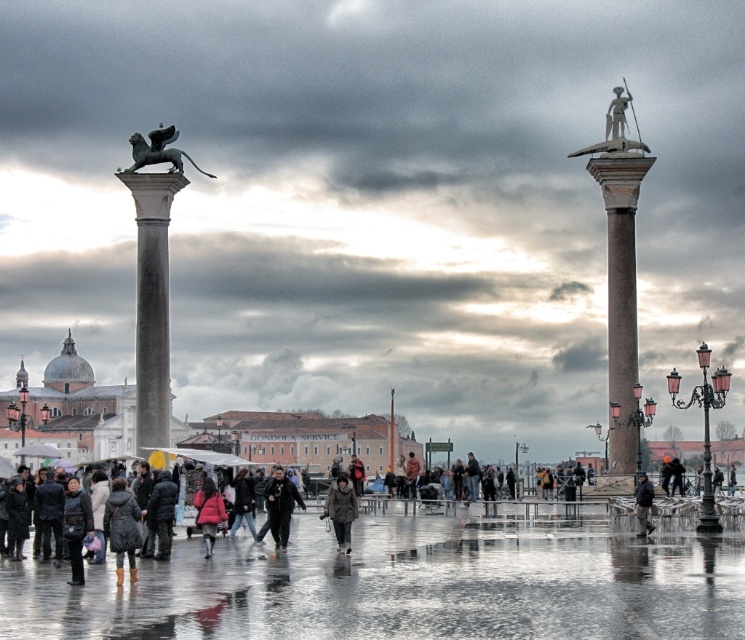
Is dark gray leather jacket at lower left closer to camera compared to dark gray jacket at lower right?

That is True.

Where is `dark gray leather jacket at lower left`? dark gray leather jacket at lower left is located at coordinates (76, 525).

In the scene shown: Measure the distance between point (82, 525) and camera.

Point (82, 525) and camera are 71.53 meters apart.

I want to click on dark gray leather jacket at lower left, so click(x=76, y=525).

Is dark gray leather jacket at lower left taller than matte pink coat at center?

Indeed, dark gray leather jacket at lower left has a greater height compared to matte pink coat at center.

Which is in front, point (74, 525) or point (203, 540)?

Point (74, 525) is in front.

Identify the location of dark gray leather jacket at lower left. (76, 525).

This screenshot has width=745, height=640. What are the coordinates of `dark gray leather jacket at lower left` in the screenshot? It's located at (76, 525).

Looking at this image, who is shorter, dark gray jacket at center or dark gray jacket at lower right?

Standing shorter between the two is dark gray jacket at lower right.

Which is above, dark gray jacket at center or dark gray jacket at lower right?

dark gray jacket at lower right is higher up.

This screenshot has height=640, width=745. What do you see at coordinates (279, 508) in the screenshot? I see `dark gray jacket at center` at bounding box center [279, 508].

Find the location of `dark gray jacket at center`. dark gray jacket at center is located at coordinates (279, 508).